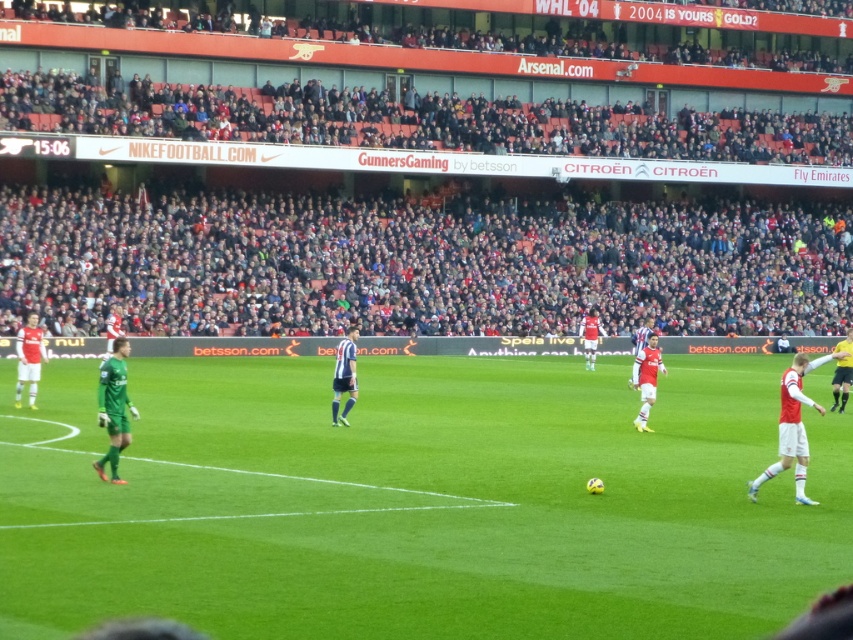
Is point (28, 352) in front of point (849, 371)?

That is True.

Which is more to the right, white jersey at left or yellow jersey at right?

From the viewer's perspective, yellow jersey at right appears more on the right side.

Is point (39, 340) less distant than point (849, 337)?

Yes, it is.

Where is `white jersey at left`? This screenshot has height=640, width=853. white jersey at left is located at coordinates (28, 358).

Is white jersey at right further to the viewer compared to white matte jersey at center?

No, white jersey at right is in front of white matte jersey at center.

Is point (793, 480) farther from camera compared to point (657, 348)?

No, (793, 480) is in front of (657, 348).

I want to click on white jersey at right, so click(x=793, y=426).

Can you confirm if green grass field at center is shorter than white jersey at left?

Yes.

The height and width of the screenshot is (640, 853). What are the coordinates of `green grass field at center` in the screenshot? It's located at (418, 500).

This screenshot has width=853, height=640. In order to click on green grass field at center in this screenshot , I will do `click(418, 500)`.